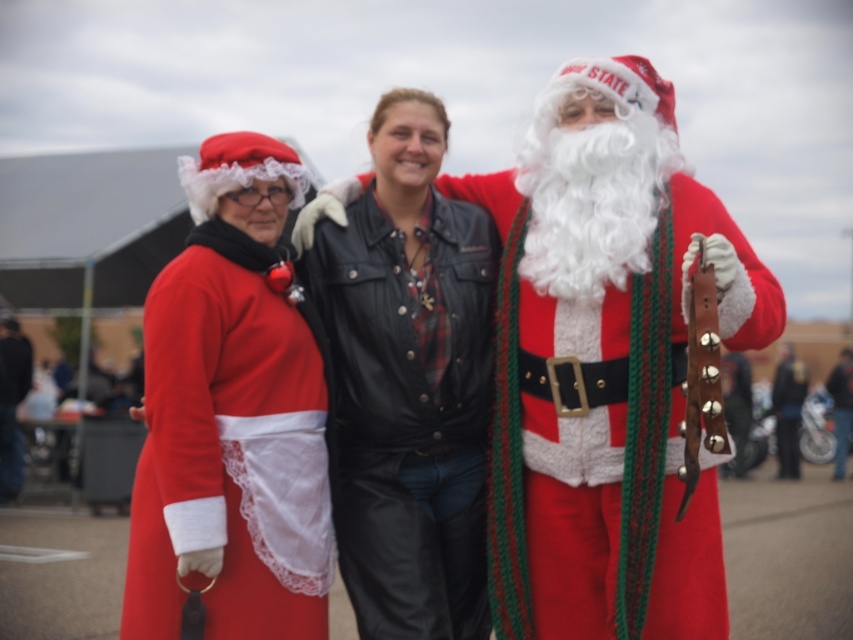
Question: Does leather jacket at center appear under shiny metallic belt at center?

Choices:
 (A) yes
 (B) no

Answer: (B)

Question: Which is nearer to the dark blue leather jacket at left?

Choices:
 (A) shiny metallic belt at center
 (B) fuzzy white beard at center
 (C) leather jacket at center

Answer: (A)

Question: Which point is farther to the camera?

Choices:
 (A) (450, 518)
 (B) (543, 109)
 (C) (3, 445)

Answer: (C)

Question: Can you confirm if leather jacket at center is bigger than dark blue leather jacket at left?

Choices:
 (A) no
 (B) yes

Answer: (A)

Question: Does fuzzy white beard at center appear under shiny metallic belt at center?

Choices:
 (A) no
 (B) yes

Answer: (A)

Question: Which is farther from the dark blue leather jacket at left?

Choices:
 (A) fuzzy white beard at center
 (B) matte red dress at center

Answer: (B)